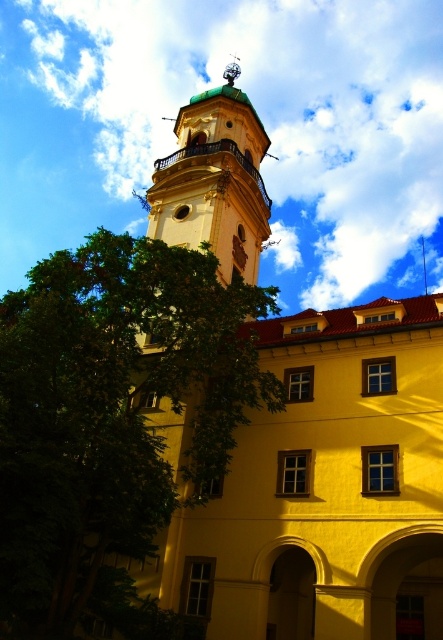
You are a bird looking for a nesting spot. The green leafy tree at left and the matte yellow bell tower at center are both options. Which one is taller for building a nest?

The matte yellow bell tower at center is taller than the green leafy tree at left, so it is a better option for nesting.

You are standing in front of the building and want to take a photo of both the green leafy tree at left and the matte yellow bell tower at center. Which object will appear larger in the photo?

The green leafy tree at left will appear larger in the photo because it is closer to the viewer than the matte yellow bell tower at center.

You are an architect reviewing the design of this building. You notice the green leafy tree at left and the matte yellow bell tower at center. Which object is positioned lower in the image?

The green leafy tree at left is positioned below the matte yellow bell tower at center, so it is lower in the image.